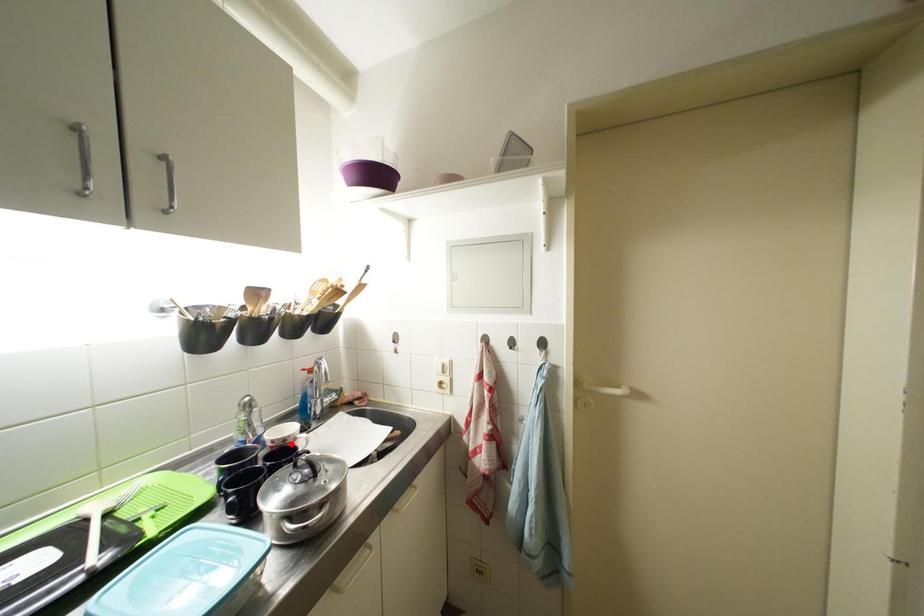
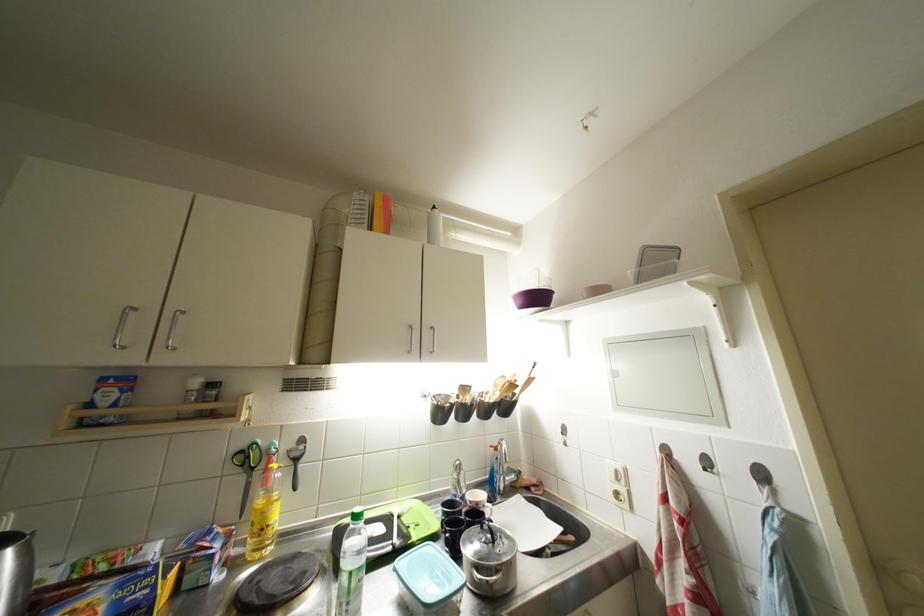
Question: I am providing you with two images of the same scene from different viewpoints. Given a red point in image1, look at the same physical point in image2. Is it:

Choices:
 (A) Closer to the viewpoint
 (B) Farther from the viewpoint

Answer: (B)